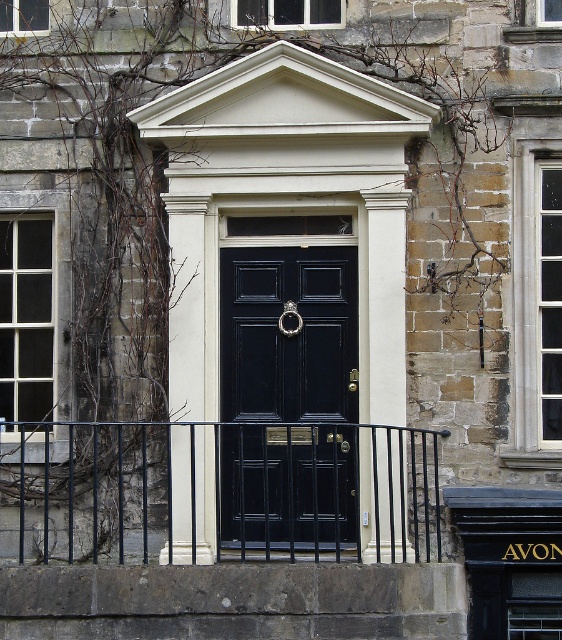
Can you confirm if black wrought iron at center is taller than matte black door at center?

No, black wrought iron at center is not taller than matte black door at center.

Who is more forward, (333, 500) or (337, 394)?

Point (333, 500) is more forward.

Describe the element at coordinates (220, 492) in the screenshot. I see `black wrought iron at center` at that location.

Locate an element on the screen. The height and width of the screenshot is (640, 562). black wrought iron at center is located at coordinates (220, 492).